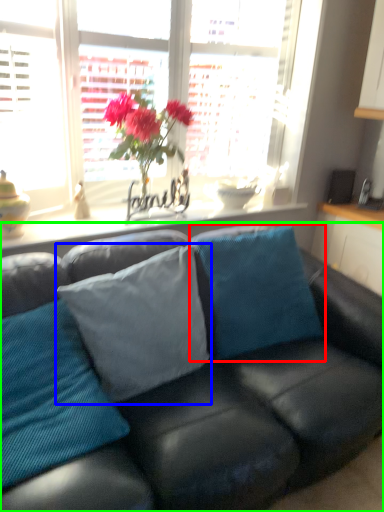
Question: Considering the real-world distances, which object is farthest from pillow (highlighted by a red box)? pillow (highlighted by a blue box) or studio couch (highlighted by a green box)?

Choices:
 (A) pillow
 (B) studio couch

Answer: (A)